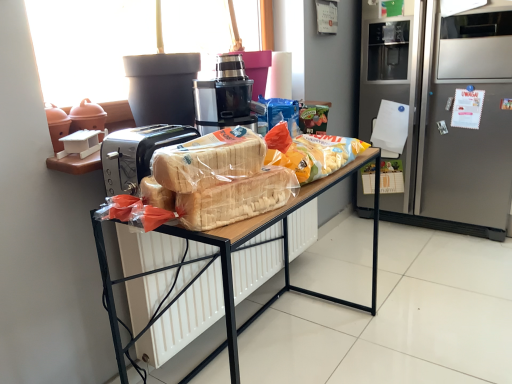
Question: From the image's perspective, is translucent plastic bag of chips at center, which appears as the 3th snack when viewed from the front, on translucent plastic bread at center, the 1th snack viewed from the front?

Choices:
 (A) yes
 (B) no

Answer: (A)

Question: Is translucent plastic bag of chips at center, which is counted as the 1th snack, starting from the back, oriented away from translucent plastic bread at center, positioned as the third snack in back-to-front order?

Choices:
 (A) no
 (B) yes

Answer: (A)

Question: Is translucent plastic bag of chips at center, which appears as the 3th snack when viewed from the front, further to camera compared to translucent plastic bread at center, positioned as the third snack in back-to-front order?

Choices:
 (A) no
 (B) yes

Answer: (B)

Question: Is translucent plastic bag of chips at center, which is counted as the 1th snack, starting from the back, thinner than translucent plastic bread at center, positioned as the third snack in back-to-front order?

Choices:
 (A) yes
 (B) no

Answer: (B)

Question: Considering the relative sizes of translucent plastic bag of chips at center, which is counted as the 1th snack, starting from the back, and translucent plastic bread at center, positioned as the third snack in back-to-front order, in the image provided, is translucent plastic bag of chips at center, which is counted as the 1th snack, starting from the back, taller than translucent plastic bread at center, positioned as the third snack in back-to-front order,?

Choices:
 (A) no
 (B) yes

Answer: (B)

Question: Considering their positions, is translucent plastic bread at center, arranged as the second snack when viewed from the back, located in front of or behind black plastic juicer at center?

Choices:
 (A) behind
 (B) front

Answer: (B)

Question: In terms of size, does translucent plastic bread at center, arranged as the second snack when viewed from the back, appear bigger or smaller than black plastic juicer at center?

Choices:
 (A) big
 (B) small

Answer: (B)

Question: From a real-world perspective, relative to black plastic juicer at center, is translucent plastic bread at center, arranged as the second snack when viewed from the back, vertically above or below?

Choices:
 (A) below
 (B) above

Answer: (A)

Question: In terms of width, does translucent plastic bread at center, arranged as the second snack when viewed from the back, look wider or thinner when compared to black plastic juicer at center?

Choices:
 (A) thin
 (B) wide

Answer: (A)

Question: Visually, is satin silver refrigerator at right positioned to the left or to the right of black plastic juicer at center?

Choices:
 (A) right
 (B) left

Answer: (A)

Question: Is satin silver refrigerator at right wider or thinner than black plastic juicer at center?

Choices:
 (A) thin
 (B) wide

Answer: (B)

Question: In terms of size, does satin silver refrigerator at right appear bigger or smaller than black plastic juicer at center?

Choices:
 (A) small
 (B) big

Answer: (B)

Question: Is point (433, 89) closer or farther from the camera than point (233, 107)?

Choices:
 (A) closer
 (B) farther

Answer: (B)

Question: In the image, is satin silver refrigerator at right positioned in front of or behind translucent plastic bag of chips at center, which appears as the 3th snack when viewed from the front?

Choices:
 (A) front
 (B) behind

Answer: (B)

Question: Is point (397, 69) positioned closer to the camera than point (275, 147)?

Choices:
 (A) closer
 (B) farther

Answer: (B)